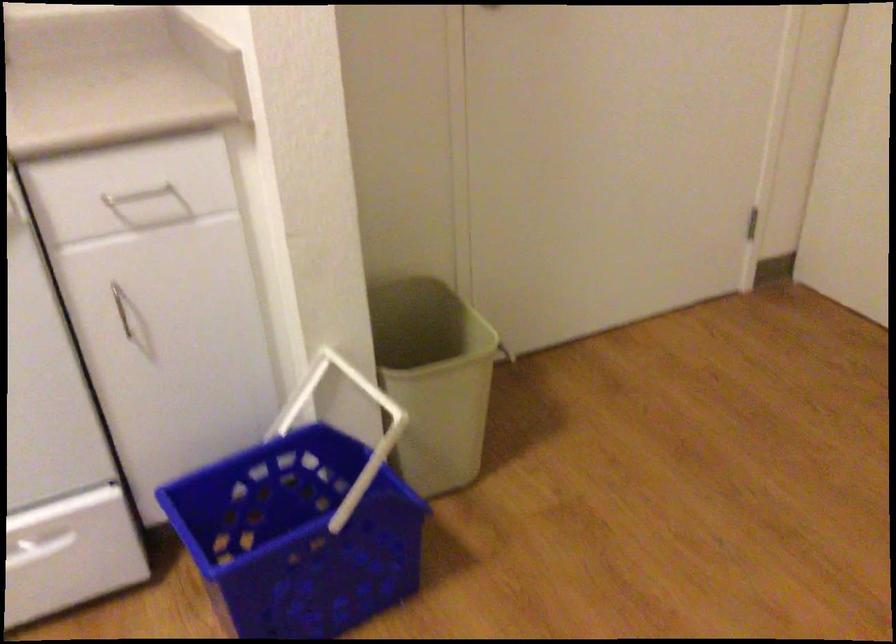
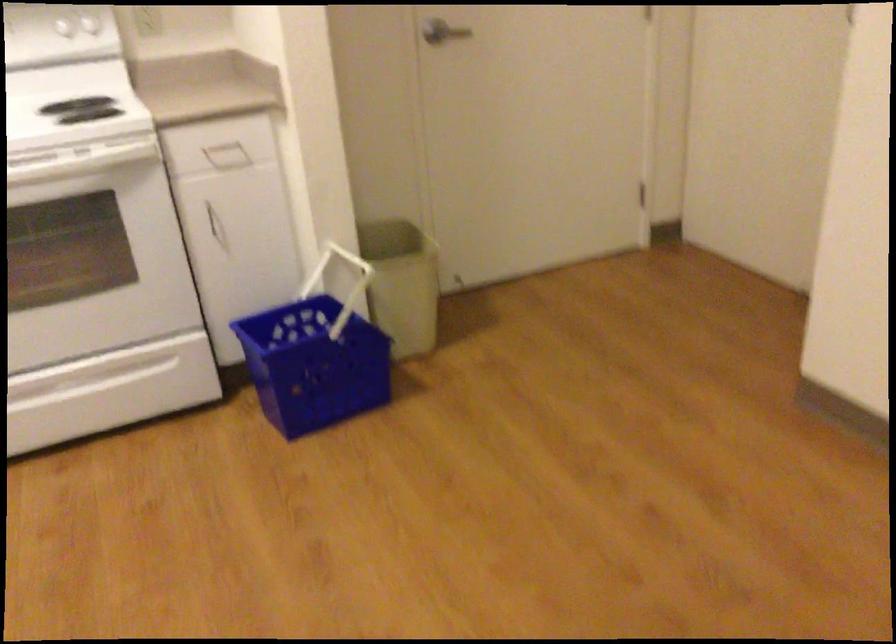
Question: Based on the continuous images, in which direction is the camera rotating? Reply with the corresponding letter.

Choices:
 (A) Left
 (B) Right
 (C) Up
 (D) Down

Answer: (C)